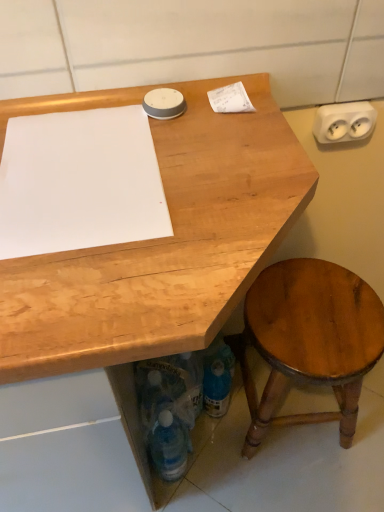
Find the location of a particular element. free space in front of white paper at upper right, acting as the second notepad starting from the bottom is located at coordinates (218, 163).